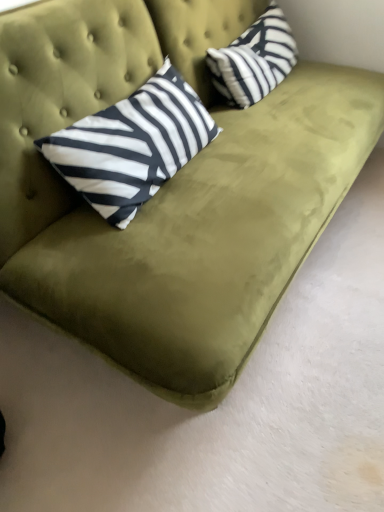
Describe the element at coordinates (254, 59) in the screenshot. Image resolution: width=384 pixels, height=512 pixels. I see `black and white striped pillow at upper right, the 2th pillow positioned from the left` at that location.

Where is `black and white striped pillow at upper right, the 2th pillow positioned from the left`? Image resolution: width=384 pixels, height=512 pixels. black and white striped pillow at upper right, the 2th pillow positioned from the left is located at coordinates (254, 59).

I want to click on white and black striped pillow at upper left, marked as the second pillow in a right-to-left arrangement, so click(x=132, y=145).

The image size is (384, 512). Describe the element at coordinates (132, 145) in the screenshot. I see `white and black striped pillow at upper left, marked as the second pillow in a right-to-left arrangement` at that location.

Locate an element on the screen. This screenshot has height=512, width=384. black and white striped pillow at upper right, positioned as the 1th pillow in right-to-left order is located at coordinates (254, 59).

Is black and white striped pillow at upper right, positioned as the 1th pillow in right-to-left order, to the right of white and black striped pillow at upper left, marked as the second pillow in a right-to-left arrangement, from the viewer's perspective?

Yes.

Relative to white and black striped pillow at upper left, marked as the second pillow in a right-to-left arrangement, is black and white striped pillow at upper right, positioned as the 1th pillow in right-to-left order, in front or behind?

Visually, black and white striped pillow at upper right, positioned as the 1th pillow in right-to-left order, is located behind white and black striped pillow at upper left, marked as the second pillow in a right-to-left arrangement.

Is point (254, 91) more distant than point (88, 179)?

Yes.

From the image's perspective, is black and white striped pillow at upper right, the 2th pillow positioned from the left, on top of white and black striped pillow at upper left, the 1th pillow when ordered from left to right?

Yes, from the image's perspective, black and white striped pillow at upper right, the 2th pillow positioned from the left, is on top of white and black striped pillow at upper left, the 1th pillow when ordered from left to right.

From a real-world perspective, does black and white striped pillow at upper right, the 2th pillow positioned from the left, sit lower than white and black striped pillow at upper left, the 1th pillow when ordered from left to right?

Yes, from a real-world perspective, black and white striped pillow at upper right, the 2th pillow positioned from the left, is beneath white and black striped pillow at upper left, the 1th pillow when ordered from left to right.

Looking at this image, which object is wider, black and white striped pillow at upper right, positioned as the 1th pillow in right-to-left order, or white and black striped pillow at upper left, the 1th pillow when ordered from left to right?

white and black striped pillow at upper left, the 1th pillow when ordered from left to right.

In terms of height, does black and white striped pillow at upper right, positioned as the 1th pillow in right-to-left order, look taller or shorter compared to white and black striped pillow at upper left, the 1th pillow when ordered from left to right?

black and white striped pillow at upper right, positioned as the 1th pillow in right-to-left order, is shorter than white and black striped pillow at upper left, the 1th pillow when ordered from left to right.

Is black and white striped pillow at upper right, the 2th pillow positioned from the left, smaller than white and black striped pillow at upper left, marked as the second pillow in a right-to-left arrangement?

Yes.

Is black and white striped pillow at upper right, the 2th pillow positioned from the left, positioned beyond the bounds of white and black striped pillow at upper left, the 1th pillow when ordered from left to right?

Yes, black and white striped pillow at upper right, the 2th pillow positioned from the left, is not within white and black striped pillow at upper left, the 1th pillow when ordered from left to right.

Is black and white striped pillow at upper right, positioned as the 1th pillow in right-to-left order, not close to white and black striped pillow at upper left, the 1th pillow when ordered from left to right?

No, black and white striped pillow at upper right, positioned as the 1th pillow in right-to-left order, is not far from white and black striped pillow at upper left, the 1th pillow when ordered from left to right.

Is black and white striped pillow at upper right, the 2th pillow positioned from the left, facing away from white and black striped pillow at upper left, marked as the second pillow in a right-to-left arrangement?

That's not correct — black and white striped pillow at upper right, the 2th pillow positioned from the left, is not looking away from white and black striped pillow at upper left, marked as the second pillow in a right-to-left arrangement.

Measure the distance between black and white striped pillow at upper right, positioned as the 1th pillow in right-to-left order, and white and black striped pillow at upper left, the 1th pillow when ordered from left to right.

black and white striped pillow at upper right, positioned as the 1th pillow in right-to-left order, and white and black striped pillow at upper left, the 1th pillow when ordered from left to right, are 50.62 centimeters apart.

In the image, there is a white and black striped pillow at upper left, marked as the second pillow in a right-to-left arrangement. Where is `pillow below it (from a real-world perspective)`? The width and height of the screenshot is (384, 512). pillow below it (from a real-world perspective) is located at coordinates (254, 59).

Is white and black striped pillow at upper left, the 1th pillow when ordered from left to right, to the right of black and white striped pillow at upper right, positioned as the 1th pillow in right-to-left order, from the viewer's perspective?

No.

Considering the positions of objects white and black striped pillow at upper left, the 1th pillow when ordered from left to right, and black and white striped pillow at upper right, positioned as the 1th pillow in right-to-left order, in the image provided, who is behind, white and black striped pillow at upper left, the 1th pillow when ordered from left to right, or black and white striped pillow at upper right, positioned as the 1th pillow in right-to-left order,?

Positioned behind is black and white striped pillow at upper right, positioned as the 1th pillow in right-to-left order.

Which is more distant, (159, 165) or (213, 83)?

The point (213, 83) is farther.

From the image's perspective, does white and black striped pillow at upper left, the 1th pillow when ordered from left to right, appear lower than black and white striped pillow at upper right, positioned as the 1th pillow in right-to-left order?

Yes, from the image's perspective, white and black striped pillow at upper left, the 1th pillow when ordered from left to right, is below black and white striped pillow at upper right, positioned as the 1th pillow in right-to-left order.

From a real-world perspective, which object rests below the other?

In real-world perspective, black and white striped pillow at upper right, positioned as the 1th pillow in right-to-left order, is lower.

Does white and black striped pillow at upper left, marked as the second pillow in a right-to-left arrangement, have a greater width compared to black and white striped pillow at upper right, the 2th pillow positioned from the left?

Correct, the width of white and black striped pillow at upper left, marked as the second pillow in a right-to-left arrangement, exceeds that of black and white striped pillow at upper right, the 2th pillow positioned from the left.

Does white and black striped pillow at upper left, marked as the second pillow in a right-to-left arrangement, have a greater height compared to black and white striped pillow at upper right, the 2th pillow positioned from the left?

Yes, white and black striped pillow at upper left, marked as the second pillow in a right-to-left arrangement, is taller than black and white striped pillow at upper right, the 2th pillow positioned from the left.

Who is smaller, white and black striped pillow at upper left, the 1th pillow when ordered from left to right, or black and white striped pillow at upper right, the 2th pillow positioned from the left?

black and white striped pillow at upper right, the 2th pillow positioned from the left.

Do you think white and black striped pillow at upper left, marked as the second pillow in a right-to-left arrangement, is within black and white striped pillow at upper right, positioned as the 1th pillow in right-to-left order, or outside of it?

white and black striped pillow at upper left, marked as the second pillow in a right-to-left arrangement, cannot be found inside black and white striped pillow at upper right, positioned as the 1th pillow in right-to-left order.

Is white and black striped pillow at upper left, marked as the second pillow in a right-to-left arrangement, not close to black and white striped pillow at upper right, the 2th pillow positioned from the left?

No.

Could you tell me if white and black striped pillow at upper left, the 1th pillow when ordered from left to right, is turned towards black and white striped pillow at upper right, the 2th pillow positioned from the left?

No, white and black striped pillow at upper left, the 1th pillow when ordered from left to right, is not oriented towards black and white striped pillow at upper right, the 2th pillow positioned from the left.

How far apart are white and black striped pillow at upper left, the 1th pillow when ordered from left to right, and black and white striped pillow at upper right, positioned as the 1th pillow in right-to-left order?

white and black striped pillow at upper left, the 1th pillow when ordered from left to right, and black and white striped pillow at upper right, positioned as the 1th pillow in right-to-left order, are 19.93 inches apart from each other.

The width and height of the screenshot is (384, 512). In the image, there is a white and black striped pillow at upper left, the 1th pillow when ordered from left to right. In order to click on pillow above it (from the image's perspective) in this screenshot , I will do click(x=254, y=59).

This screenshot has height=512, width=384. Identify the location of pillow that is behind the white and black striped pillow at upper left, marked as the second pillow in a right-to-left arrangement. (254, 59).

Where is `pillow in front of the black and white striped pillow at upper right, the 2th pillow positioned from the left`? Image resolution: width=384 pixels, height=512 pixels. pillow in front of the black and white striped pillow at upper right, the 2th pillow positioned from the left is located at coordinates (132, 145).